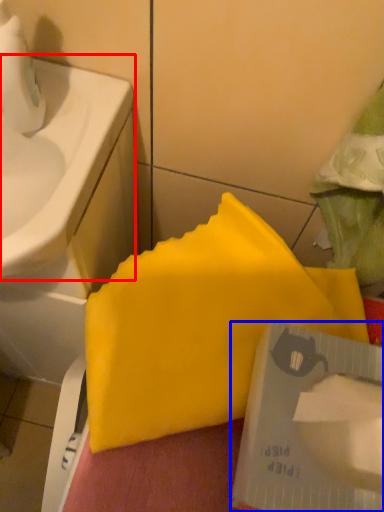
Question: Which object is closer to the camera taking this photo, sink (highlighted by a red box) or writing (highlighted by a blue box)?

Choices:
 (A) sink
 (B) writing

Answer: (B)